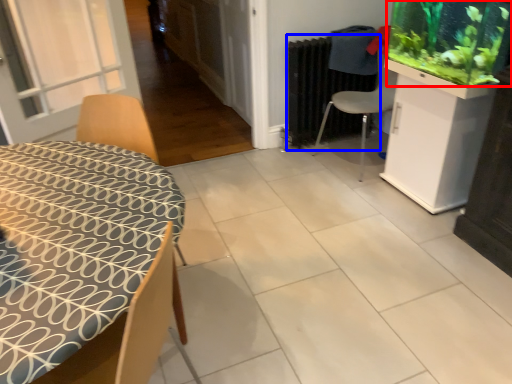
Question: Which of the following is the closest to the observer, plant (highlighted by a red box) or radiator (highlighted by a blue box)?

Choices:
 (A) plant
 (B) radiator

Answer: (A)